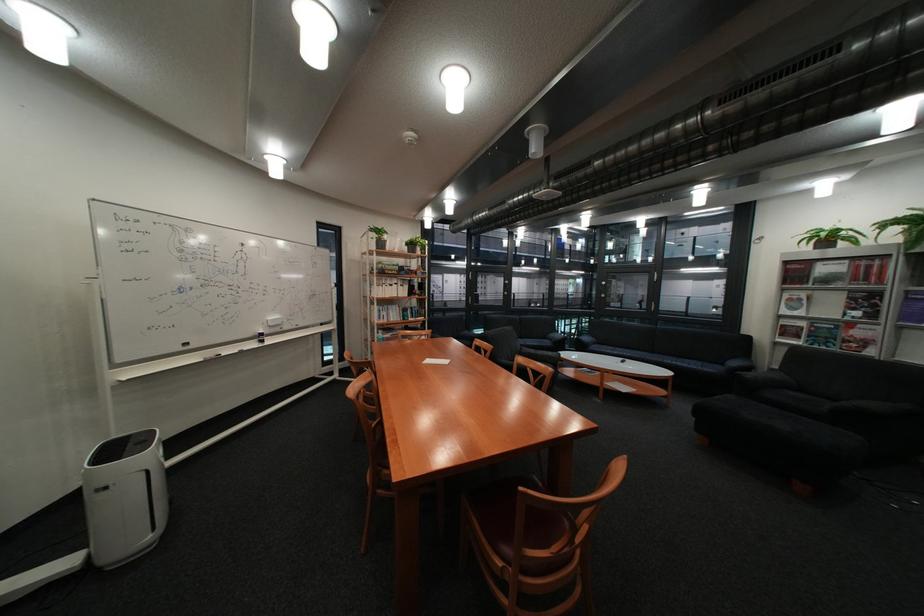
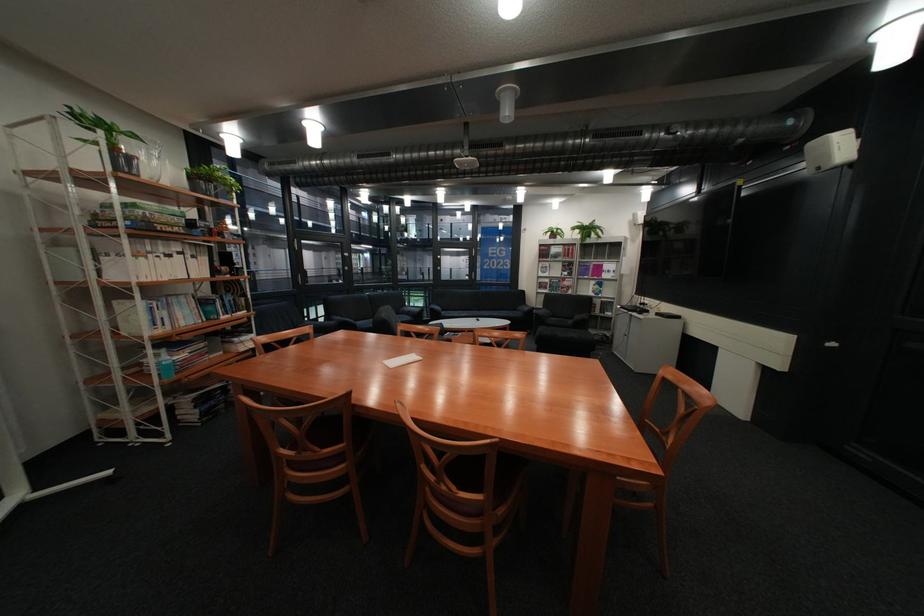
Where in the second image is the point corresponding to [400,249] from the first image?

(152, 177)